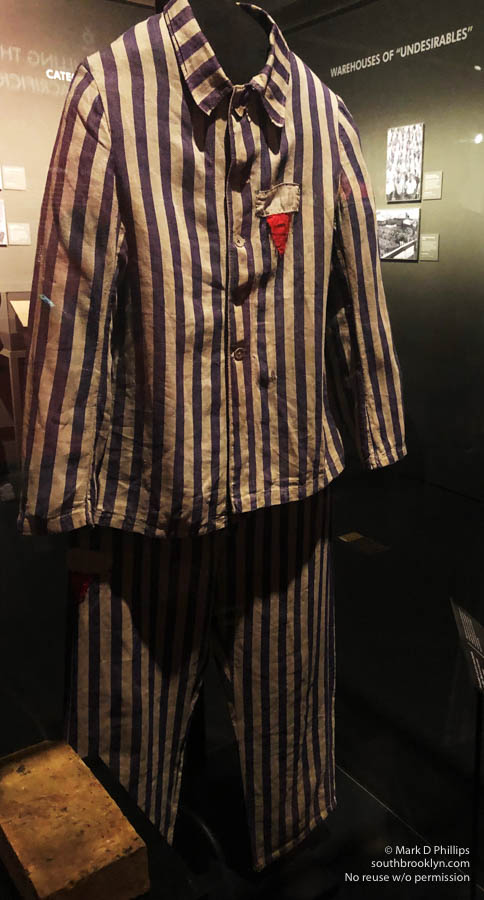
Locate an element on the screen. Image resolution: width=484 pixels, height=900 pixels. horizontal black n white rectangular photo is located at coordinates (387, 230).